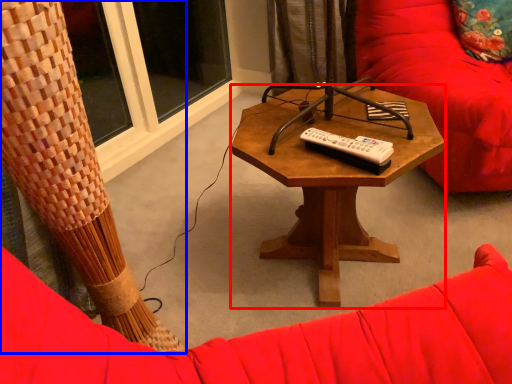
Question: Which object appears closest to the camera in this image, coffee table (highlighted by a red box) or curtain (highlighted by a blue box)?

Choices:
 (A) coffee table
 (B) curtain

Answer: (B)